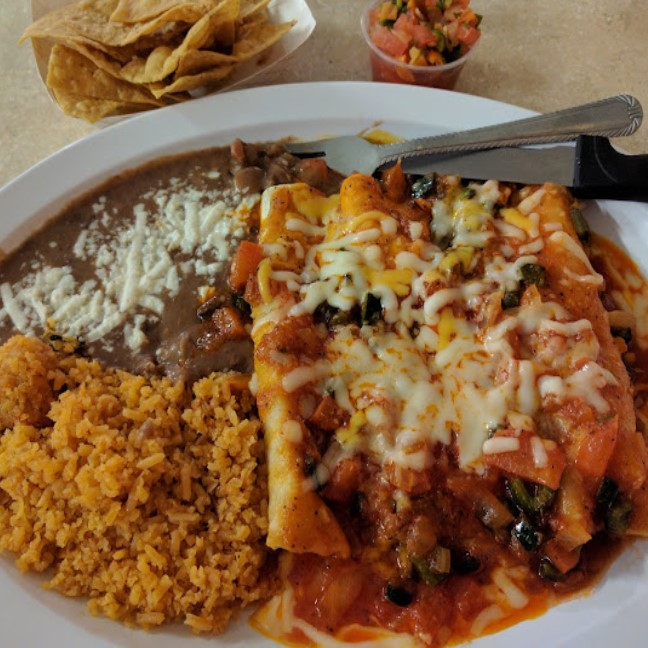
Identify the location of plate. (52, 181).